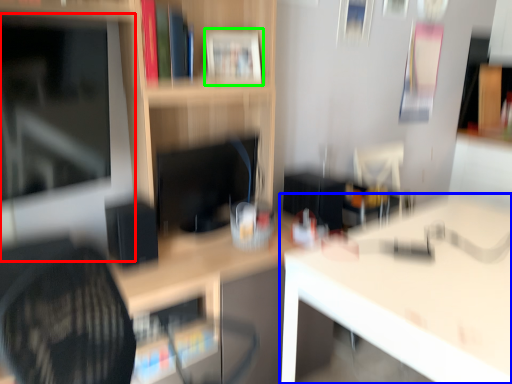
Question: Which object is the closest to the computer monitor (highlighted by a red box)? Choose among these: table (highlighted by a blue box) or book (highlighted by a green box).

Choices:
 (A) table
 (B) book

Answer: (B)